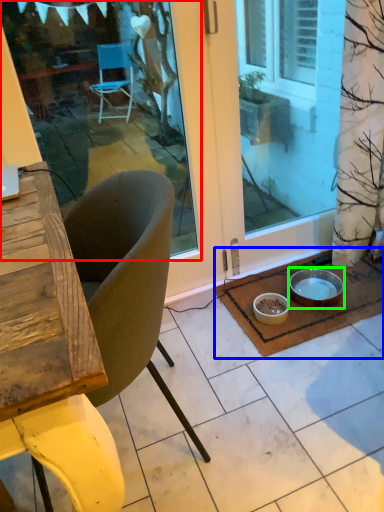
Question: Based on their relative distances, which object is farther from window screen (highlighted by a red box)? Choose from doormat (highlighted by a blue box) and bowl (highlighted by a green box).

Choices:
 (A) doormat
 (B) bowl

Answer: (B)